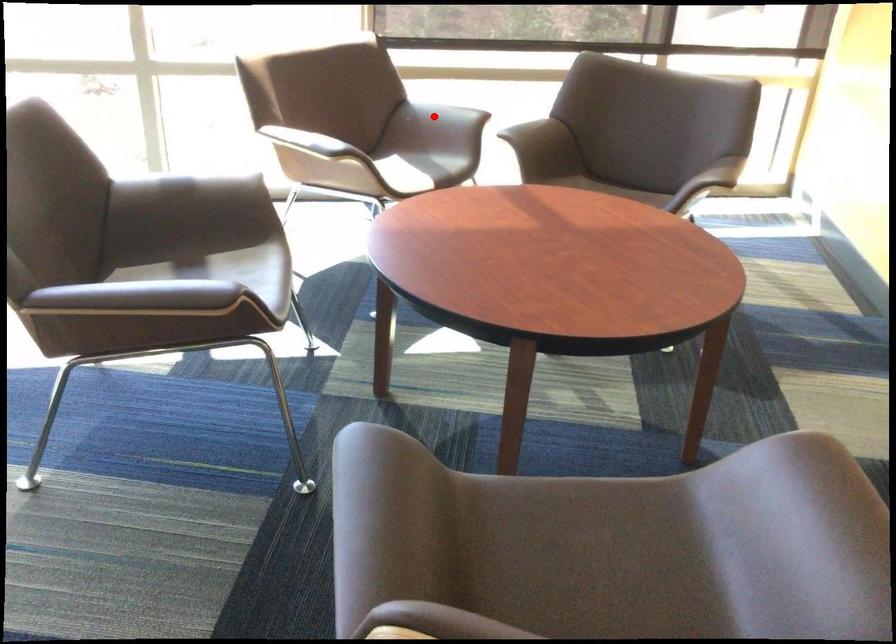
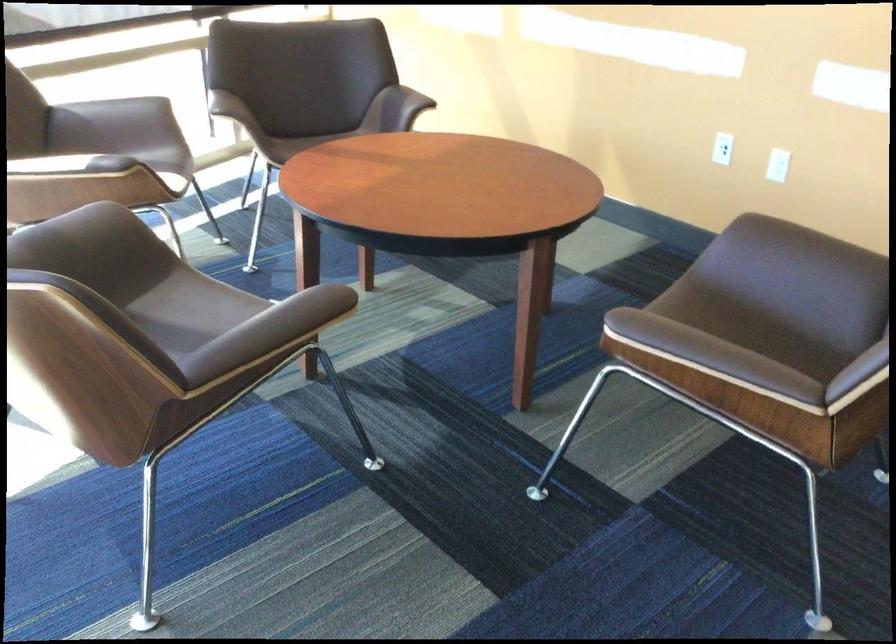
The point at the highlighted location is marked in the first image. Where is the corresponding point in the second image?

(115, 118)